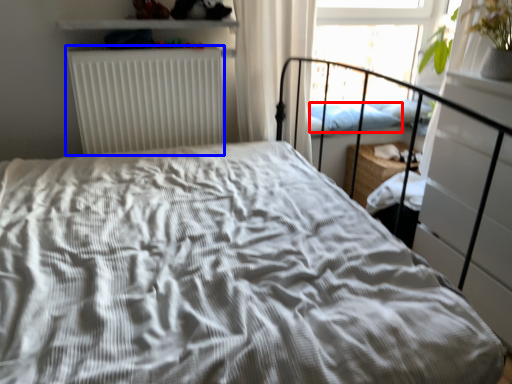
Question: Which object appears farthest to the camera in this image, pillow (highlighted by a red box) or radiator (highlighted by a blue box)?

Choices:
 (A) pillow
 (B) radiator

Answer: (A)